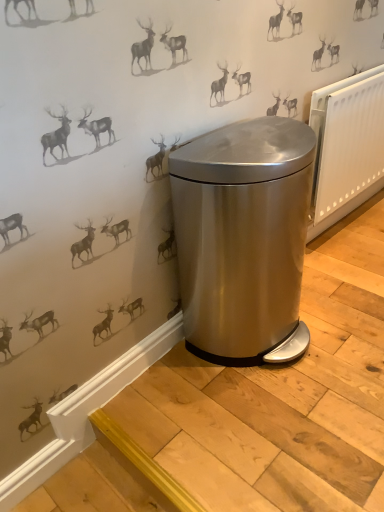
Question: In terms of height, does satin silver trash can at center look taller or shorter compared to white plastic radiator at right?

Choices:
 (A) tall
 (B) short

Answer: (A)

Question: From a real-world perspective, is satin silver trash can at center above or below white plastic radiator at right?

Choices:
 (A) below
 (B) above

Answer: (A)

Question: From the image's perspective, is satin silver trash can at center positioned above or below white plastic radiator at right?

Choices:
 (A) above
 (B) below

Answer: (B)

Question: In terms of width, does white plastic radiator at right look wider or thinner when compared to satin silver trash can at center?

Choices:
 (A) thin
 (B) wide

Answer: (A)

Question: Is white plastic radiator at right bigger or smaller than satin silver trash can at center?

Choices:
 (A) big
 (B) small

Answer: (B)

Question: From the image's perspective, is white plastic radiator at right located above or below satin silver trash can at center?

Choices:
 (A) above
 (B) below

Answer: (A)

Question: Is white plastic radiator at right in front of or behind satin silver trash can at center in the image?

Choices:
 (A) behind
 (B) front

Answer: (A)